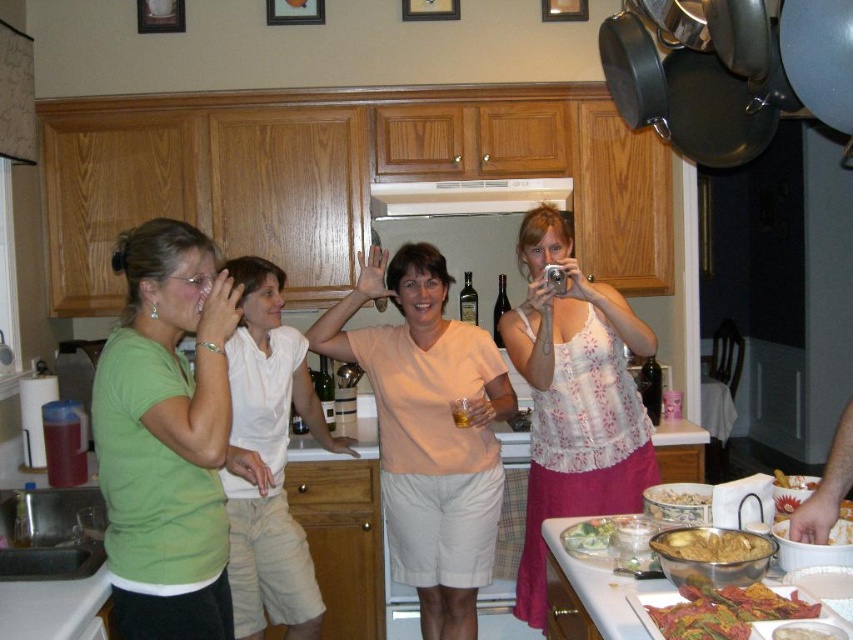
Question: Which object is closer to the camera taking this photo?

Choices:
 (A) white cotton shirt at center
 (B) shiny metallic bowl at center

Answer: (B)

Question: Considering the relative positions of green matte shirt at left and shiny metallic bowl at center right in the image provided, where is green matte shirt at left located with respect to shiny metallic bowl at center right?

Choices:
 (A) right
 (B) left

Answer: (B)

Question: Does white cotton shirt at center have a greater width compared to shiny metallic bowl at center right?

Choices:
 (A) yes
 (B) no

Answer: (A)

Question: Which of the following is the farthest from the observer?

Choices:
 (A) floral tank top at center
 (B) white cotton shirt at center
 (C) green matte shirt at left
 (D) shiny metallic bowl at lower right

Answer: (B)

Question: Is white cotton shirt at center wider than green leafy salad at center?

Choices:
 (A) yes
 (B) no

Answer: (A)

Question: Which point is farther to the camera?

Choices:
 (A) (628, 532)
 (B) (827, 625)
 (C) (770, 600)

Answer: (A)